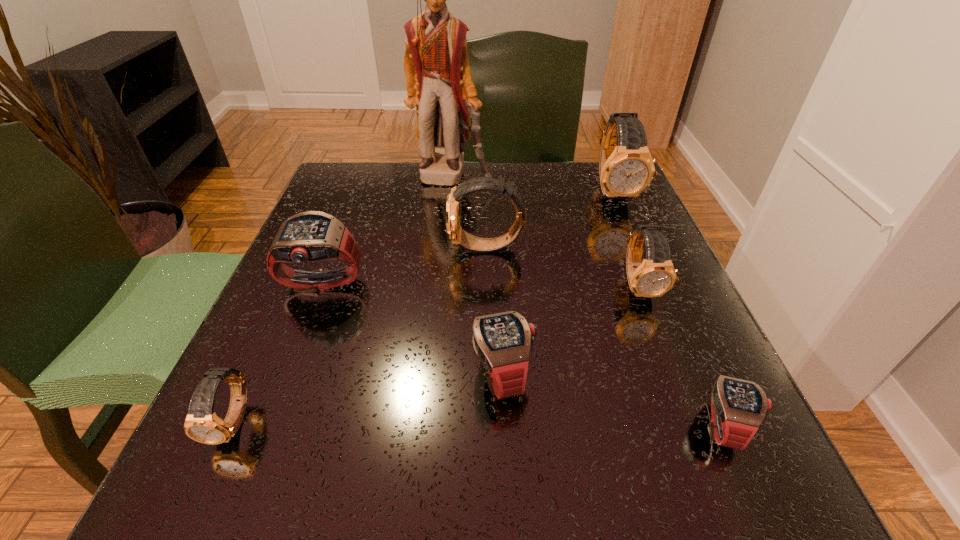
What are the coordinates of `the third closest gold watch relative to the second nearest gold watch` in the screenshot? It's located at (202, 424).

Identify the location of red watch that is the third closest one to the third farthest gold watch. (307, 237).

Identify which red watch is located as the second nearest to the second farthest gold watch. Please provide its 2D coordinates. Your answer should be formatted as a tuple, i.e. [(x, y)], where the tuple contains the x and y coordinates of a point satisfying the conditions above.

[(503, 341)]

The image size is (960, 540). What are the coordinates of `free region that satisfies the following two spatial constraints: 1. on the face of the rightmost red watch; 2. on the left side of the second smallest gold watch` in the screenshot? It's located at (693, 426).

Locate an element on the screen. The height and width of the screenshot is (540, 960). free space that satisfies the following two spatial constraints: 1. on the front-facing side of the shortest object; 2. on the right side of the tallest object is located at coordinates (431, 426).

At what (x,y) coordinates should I click in order to perform the action: click on vacant space that satisfies the following two spatial constraints: 1. on the front-facing side of the smallest red watch; 2. on the right side of the nutcracker. Please return your answer as a coordinate pair (x, y). Looking at the image, I should click on (431, 426).

This screenshot has height=540, width=960. In order to click on vacant region that satisfies the following two spatial constraints: 1. on the front side of the farthest red watch; 2. on the left side of the shortest object in this screenshot , I will do `click(266, 426)`.